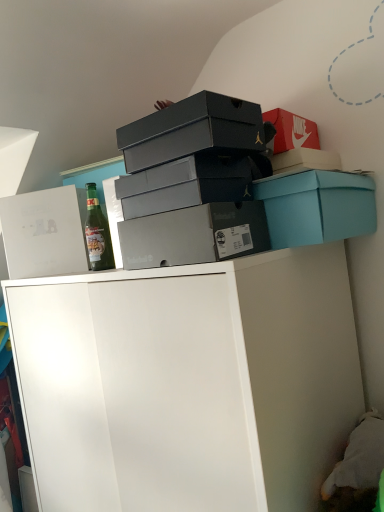
Question: Based on their positions, is white matte cabinet at upper center located to the left or right of white cardboard box at upper left, marked as the 1th box in a left-to-right arrangement?

Choices:
 (A) right
 (B) left

Answer: (A)

Question: From their relative heights in the image, would you say white matte cabinet at upper center is taller or shorter than white cardboard box at upper left, marked as the 1th box in a left-to-right arrangement?

Choices:
 (A) short
 (B) tall

Answer: (B)

Question: Considering the real-world distances, which object is farthest from the green glass bottle at left?

Choices:
 (A) white matte cabinet at upper center
 (B) white cardboard box at upper left, the fifth box positioned from the right
 (C) matte gray shoebox at center, which is counted as the 3th box, starting from the right
 (D) matte black shoebox at upper center, the second box when ordered from left to right
 (E) matte gray shoebox at center, placed as the 2th box when sorted from right to left

Answer: (A)

Question: Which is nearer to the matte black shoebox at upper center, which is the fourth box from right to left?

Choices:
 (A) white matte cabinet at upper center
 (B) white cardboard box at upper left, marked as the 1th box in a left-to-right arrangement
 (C) green glass bottle at left
 (D) matte gray shoebox at center, which is counted as the 3th box, starting from the right
 (E) matte gray shoebox at center, placed as the 2th box when sorted from right to left

Answer: (D)